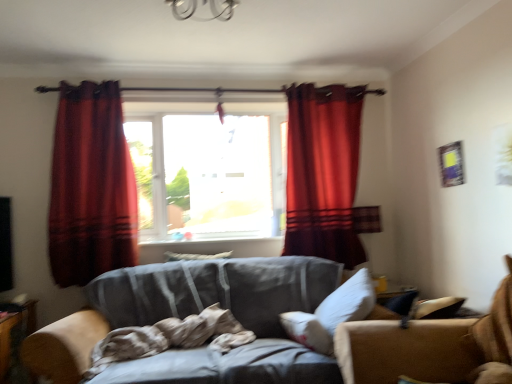
The image size is (512, 384). In order to click on white soft pillow at center, the second pillow from the back in this screenshot , I will do `click(332, 313)`.

Describe the element at coordinates (332, 313) in the screenshot. I see `white soft pillow at center, placed as the second pillow when sorted from left to right` at that location.

This screenshot has width=512, height=384. What do you see at coordinates (208, 168) in the screenshot? I see `transparent glass window at center` at bounding box center [208, 168].

In order to face gray fabric couch at center, should I rotate leftwards or rightwards?

It's best to rotate left around 5.524 degrees.

What do you see at coordinates (91, 186) in the screenshot? The image size is (512, 384). I see `velvet red curtain at left, the 2th curtain in the right-to-left sequence` at bounding box center [91, 186].

You are a GUI agent. You are given a task and a screenshot of the screen. Output one action in this format:
    pyautogui.click(x=<x>, y=<y>)
    Task: Click on the white soft pillow at center, marked as the 1th pillow in a back-to-front arrangement
    
    Given the screenshot: What is the action you would take?
    pyautogui.click(x=195, y=256)

Does gray fabric couch at center turn towards white soft pillow at center, placed as the second pillow when sorted from left to right?

Yes, gray fabric couch at center is turned towards white soft pillow at center, placed as the second pillow when sorted from left to right.

Is gray fabric couch at center to the right of white soft pillow at center, the second pillow from the back, from the viewer's perspective?

No, gray fabric couch at center is not to the right of white soft pillow at center, the second pillow from the back.

Is the position of gray fabric couch at center more distant than that of white soft pillow at center, which ranks as the first pillow in right-to-left order?

No, it is not.

At what (x,y) coordinates should I click in order to perform the action: click on window above the white soft pillow at center, marked as the 1th pillow in a back-to-front arrangement (from a real-world perspective). Please return your answer as a coordinate pair (x, y). Image resolution: width=512 pixels, height=384 pixels. Looking at the image, I should click on (208, 168).

Is white soft pillow at center, which is the first pillow from left to right, looking in the opposite direction of transparent glass window at center?

No.

Is white soft pillow at center, arranged as the second pillow when viewed from the right, taller or shorter than transparent glass window at center?

In the image, white soft pillow at center, arranged as the second pillow when viewed from the right, appears to be shorter than transparent glass window at center.

Is white soft pillow at center, which is the first pillow from left to right, not inside transparent glass window at center?

white soft pillow at center, which is the first pillow from left to right, lies outside transparent glass window at center's area.

Are white soft pillow at center, arranged as the 2th pillow when ordered from the bottom, and gray fabric couch at center making contact?

white soft pillow at center, arranged as the 2th pillow when ordered from the bottom, and gray fabric couch at center are not in contact.

How different are the orientations of white soft pillow at center, positioned as the second pillow in front-to-back order, and gray fabric couch at center in degrees?

The angle between the facing direction of white soft pillow at center, positioned as the second pillow in front-to-back order, and the facing direction of gray fabric couch at center is 0.000104 degrees.

In the image, is white soft pillow at center, the 1th pillow from the top, positioned in front of or behind gray fabric couch at center?

Clearly, white soft pillow at center, the 1th pillow from the top, is behind gray fabric couch at center.

Which is correct: white soft pillow at center, the 1th pillow from the top, is inside gray fabric couch at center, or outside of it?

white soft pillow at center, the 1th pillow from the top, is outside gray fabric couch at center.

Is white soft pillow at center, arranged as the second pillow when viewed from the right, smaller than velvet red curtain at left, the 2th curtain in the right-to-left sequence?

Yes.

Looking at this image, can velvet red curtain at left, the 2th curtain in the right-to-left sequence, be found inside white soft pillow at center, arranged as the 2th pillow when ordered from the bottom?

No, white soft pillow at center, arranged as the 2th pillow when ordered from the bottom, does not contain velvet red curtain at left, the 2th curtain in the right-to-left sequence.

From the image's perspective, relative to velvet red curtain at left, the 2th curtain in the right-to-left sequence, is white soft pillow at center, positioned as the second pillow in front-to-back order, above or below?

white soft pillow at center, positioned as the second pillow in front-to-back order, is situated lower than velvet red curtain at left, the 2th curtain in the right-to-left sequence, in the image.

Locate an element on the screen. curtain that is the 1st one when counting upward from the white soft pillow at center, arranged as the 2th pillow when ordered from the bottom (from the image's perspective) is located at coordinates (91, 186).

Is velvet red curtain at center, which appears as the 1th curtain when viewed from the right, at the back of white soft pillow at center, arranged as the 2th pillow when ordered from the bottom?

No, white soft pillow at center, arranged as the 2th pillow when ordered from the bottom, is not facing away from velvet red curtain at center, which appears as the 1th curtain when viewed from the right.

Is white soft pillow at center, arranged as the second pillow when viewed from the right, not near velvet red curtain at center, which appears as the 1th curtain when viewed from the right?

They are positioned close to each other.

Between white soft pillow at center, arranged as the second pillow when viewed from the right, and velvet red curtain at center, positioned as the 2th curtain in left-to-right order, which one has smaller width?

white soft pillow at center, arranged as the second pillow when viewed from the right, is thinner.

There is a white soft pillow at center, marked as the 1th pillow in a back-to-front arrangement. Where is `the 2nd curtain above it (from a real-world perspective)`? This screenshot has height=384, width=512. the 2nd curtain above it (from a real-world perspective) is located at coordinates (323, 172).

Are velvet red curtain at center, which appears as the 1th curtain when viewed from the right, and velvet red curtain at left, arranged as the first curtain when viewed from the left, far apart?

Indeed, velvet red curtain at center, which appears as the 1th curtain when viewed from the right, is not near velvet red curtain at left, arranged as the first curtain when viewed from the left.

Is velvet red curtain at center, which appears as the 1th curtain when viewed from the right, bigger or smaller than velvet red curtain at left, the 2th curtain in the right-to-left sequence?

Clearly, velvet red curtain at center, which appears as the 1th curtain when viewed from the right, is larger in size than velvet red curtain at left, the 2th curtain in the right-to-left sequence.

Does velvet red curtain at center, which appears as the 1th curtain when viewed from the right, turn towards velvet red curtain at left, the 2th curtain in the right-to-left sequence?

No, velvet red curtain at center, which appears as the 1th curtain when viewed from the right, is not oriented towards velvet red curtain at left, the 2th curtain in the right-to-left sequence.

Which object is thinner, velvet red curtain at left, the 2th curtain in the right-to-left sequence, or white soft pillow at center, placed as the second pillow when sorted from left to right?

With smaller width is white soft pillow at center, placed as the second pillow when sorted from left to right.

Can you tell me how much velvet red curtain at left, arranged as the first curtain when viewed from the left, and white soft pillow at center, positioned as the first pillow in front-to-back order, differ in facing direction?

There is a 83.1-degree angle between the facing directions of velvet red curtain at left, arranged as the first curtain when viewed from the left, and white soft pillow at center, positioned as the first pillow in front-to-back order.

Does point (73, 221) come farther from viewer compared to point (369, 280)?

Yes, it is.

Considering the positions of objects velvet red curtain at left, arranged as the first curtain when viewed from the left, and white soft pillow at center, the second pillow from the back, in the image provided, who is behind, velvet red curtain at left, arranged as the first curtain when viewed from the left, or white soft pillow at center, the second pillow from the back,?

velvet red curtain at left, arranged as the first curtain when viewed from the left.

At what (x,y) coordinates should I click in order to perform the action: click on studio couch in front of the white soft pillow at center, the second pillow from the back. Please return your answer as a coordinate pair (x, y). The width and height of the screenshot is (512, 384). Looking at the image, I should click on (426, 345).

I want to click on window behind the white soft pillow at center, arranged as the 2th pillow when ordered from the bottom, so click(208, 168).

From the image, which object appears to be nearer to gray fabric couch at center, velvet red curtain at center, which appears as the 1th curtain when viewed from the right, or white soft pillow at center, positioned as the second pillow in front-to-back order?

Among the two, velvet red curtain at center, which appears as the 1th curtain when viewed from the right, is located nearer to gray fabric couch at center.

Which object lies further to the anchor point gray fabric couch at center, white soft pillow at center, marked as the 1th pillow in a back-to-front arrangement, or velvet red curtain at center, positioned as the 2th curtain in left-to-right order?

Among the two, white soft pillow at center, marked as the 1th pillow in a back-to-front arrangement, is located further to gray fabric couch at center.

Estimate the real-world distances between objects in this image. Which object is further from white soft pillow at center, the second pillow viewed from the top, gray fabric couch at center or velvet red curtain at left, the 2th curtain in the right-to-left sequence?

The object further to white soft pillow at center, the second pillow viewed from the top, is velvet red curtain at left, the 2th curtain in the right-to-left sequence.

When comparing their distances from velvet red curtain at left, arranged as the first curtain when viewed from the left, does transparent glass window at center or gray fabric couch at center seem further?

gray fabric couch at center.

Considering their positions, is transparent glass window at center positioned closer to velvet red curtain at center, which appears as the 1th curtain when viewed from the right, than white soft pillow at center, which ranks as the first pillow in right-to-left order?

The object closer to velvet red curtain at center, which appears as the 1th curtain when viewed from the right, is transparent glass window at center.

From the image, which object appears to be farther from white soft pillow at center, the 1th pillow when ordered from bottom to top, velvet red curtain at left, the 2th curtain in the right-to-left sequence, or transparent glass window at center?

velvet red curtain at left, the 2th curtain in the right-to-left sequence.

Which object lies nearer to the anchor point white soft pillow at center, arranged as the second pillow when viewed from the right, velvet red curtain at left, arranged as the first curtain when viewed from the left, or velvet red curtain at center, which appears as the 1th curtain when viewed from the right?

velvet red curtain at left, arranged as the first curtain when viewed from the left, is positioned closer to the anchor white soft pillow at center, arranged as the second pillow when viewed from the right.

Considering their positions, is velvet red curtain at left, the 2th curtain in the right-to-left sequence, positioned further to transparent glass window at center than white soft pillow at center, which is the first pillow from left to right?

Among the two, white soft pillow at center, which is the first pillow from left to right, is located further to transparent glass window at center.

This screenshot has height=384, width=512. In order to click on window situated between white soft pillow at center, marked as the 1th pillow in a back-to-front arrangement, and velvet red curtain at center, positioned as the 2th curtain in left-to-right order, from left to right in this screenshot , I will do `click(208, 168)`.

Locate an element on the screen. studio couch between velvet red curtain at left, the 2th curtain in the right-to-left sequence, and white soft pillow at center, the 1th pillow when ordered from bottom to top is located at coordinates click(x=426, y=345).

Identify the location of window located between velvet red curtain at left, arranged as the first curtain when viewed from the left, and velvet red curtain at center, positioned as the 2th curtain in left-to-right order, in the left-right direction. The width and height of the screenshot is (512, 384). (208, 168).

Locate an element on the screen. This screenshot has height=384, width=512. curtain located between gray fabric couch at center and white soft pillow at center, which is the first pillow from left to right, in the depth direction is located at coordinates (91, 186).